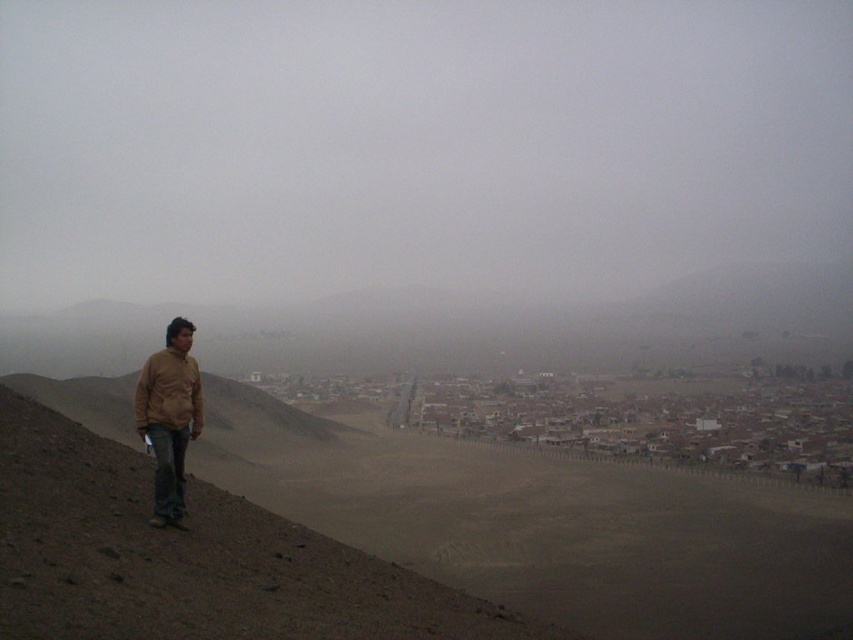
You are standing at the camera position and want to walk to the point at coordinates (x=195, y=433). The path is a straight line across the barren hillside. If your walking speed is 3 feet per second, how many seconds will it take you to reach the point?

The distance between the camera and the point at (x=195, y=433) is 34.00 feet. At a speed of 3 feet per second, it will take 34.00 divided by 3, which equals approximately 11.33 seconds to reach the point.

You are a photographer trying to capture the matte brown jacket at left. Where should you position your camera relative to the point marked as point [169,417]?

The point [169,417] marks the location of the matte brown jacket at left, so you should position your camera directly facing that point to capture the jacket.

What are the coordinates of the dull brown dirt at left in the image?

The coordinates of the dull brown dirt at left are at point (189,557).